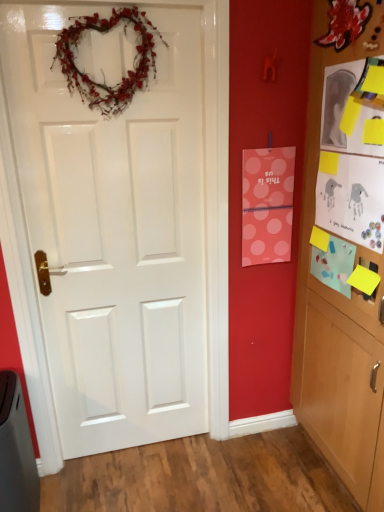
Locate an element on the screen. The image size is (384, 512). vacant area that lies in front of white glossy door at center is located at coordinates (140, 483).